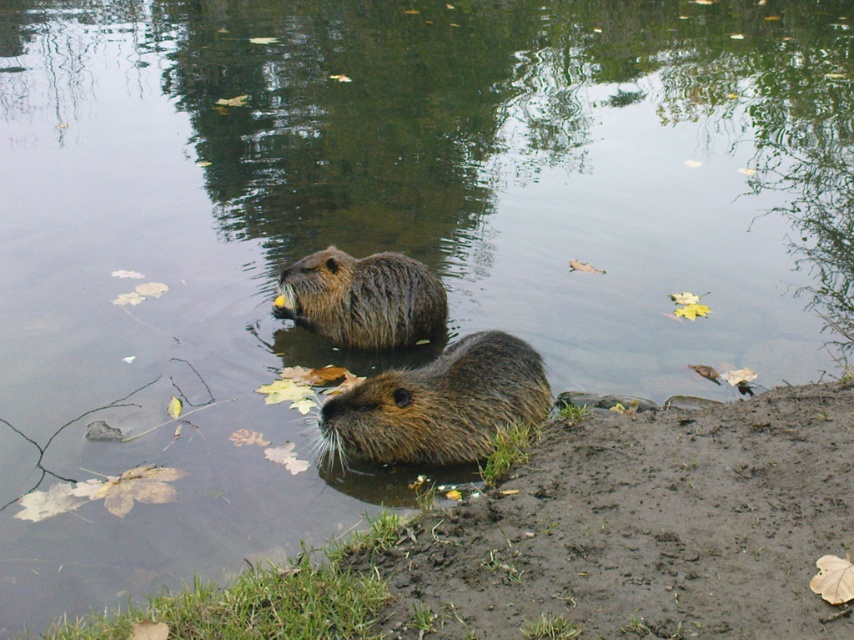
Question: Does fuzzy brown otter at lower center have a larger size compared to brown fuzzy otter at center?

Choices:
 (A) yes
 (B) no

Answer: (A)

Question: Considering the real-world distances, which object is farthest from the brown fluffy mud at lower center?

Choices:
 (A) brown fuzzy otter at center
 (B) fuzzy brown otter at lower center

Answer: (A)

Question: Which point is farther from the camera taking this photo?

Choices:
 (A) (412, 317)
 (B) (832, 532)

Answer: (A)

Question: Is brown fluffy mud at lower center bigger than fuzzy brown otter at lower center?

Choices:
 (A) yes
 (B) no

Answer: (A)

Question: Is brown fluffy mud at lower center positioned before brown fuzzy otter at center?

Choices:
 (A) yes
 (B) no

Answer: (A)

Question: Which point is farther to the camera?

Choices:
 (A) fuzzy brown otter at lower center
 (B) brown fluffy mud at lower center

Answer: (A)